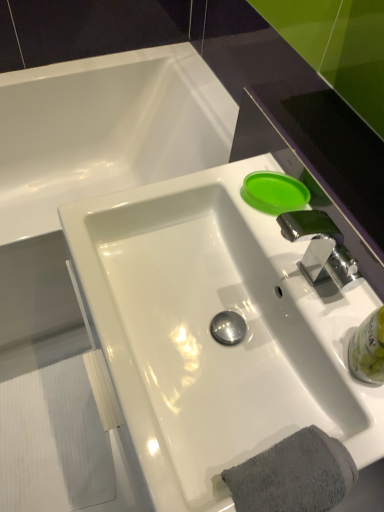
Question: Considering the relative positions of white glossy sink at center and gray cotton towel at lower right in the image provided, is white glossy sink at center to the right of gray cotton towel at lower right from the viewer's perspective?

Choices:
 (A) yes
 (B) no

Answer: (B)

Question: Is white glossy sink at center shorter than gray cotton towel at lower right?

Choices:
 (A) no
 (B) yes

Answer: (B)

Question: Is gray cotton towel at lower right at the back of white glossy sink at center?

Choices:
 (A) yes
 (B) no

Answer: (B)

Question: Is the depth of white glossy sink at center less than that of gray cotton towel at lower right?

Choices:
 (A) no
 (B) yes

Answer: (A)

Question: Is gray cotton towel at lower right surrounded by white glossy sink at center?

Choices:
 (A) no
 (B) yes

Answer: (B)

Question: Would you consider white glossy sink at center to be distant from gray cotton towel at lower right?

Choices:
 (A) yes
 (B) no

Answer: (B)

Question: Is white glossy sink at center wider than clear plastic bottle at lower right, the 1th liquid viewed from the front?

Choices:
 (A) no
 (B) yes

Answer: (B)

Question: Is white glossy sink at center far away from clear plastic bottle at lower right, placed as the second liquid when sorted from left to right?

Choices:
 (A) yes
 (B) no

Answer: (B)

Question: Does white glossy sink at center have a smaller size compared to clear plastic bottle at lower right, which is the second liquid in top-to-bottom order?

Choices:
 (A) yes
 (B) no

Answer: (B)

Question: From a real-world perspective, does white glossy sink at center sit lower than clear plastic bottle at lower right, which is the second liquid in top-to-bottom order?

Choices:
 (A) no
 (B) yes

Answer: (B)

Question: From the image's perspective, is white glossy sink at center under clear plastic bottle at lower right, the 1th liquid viewed from the front?

Choices:
 (A) yes
 (B) no

Answer: (B)

Question: Considering the relative sizes of white glossy sink at center and clear plastic bottle at lower right, placed as the second liquid when sorted from left to right, in the image provided, is white glossy sink at center shorter than clear plastic bottle at lower right, placed as the second liquid when sorted from left to right,?

Choices:
 (A) no
 (B) yes

Answer: (B)

Question: Does clear plastic bottle at lower right, the 1th liquid positioned from the bottom, lie behind green matte lid at upper right, the 2th liquid positioned from the front?

Choices:
 (A) no
 (B) yes

Answer: (A)